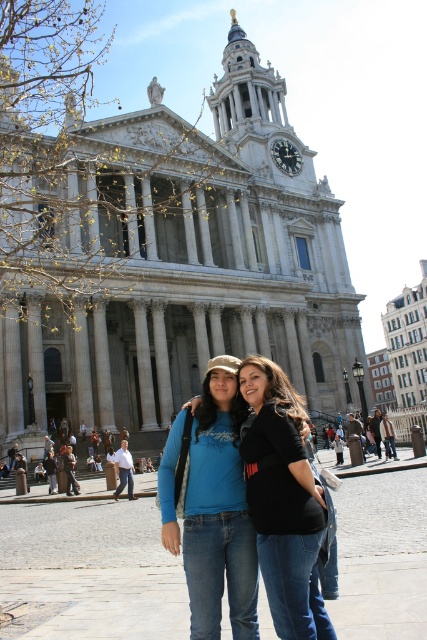
Looking at this image, you are a photographer standing in front of St. Paul Cathedral. You see the matte blue shirt at center and the denim jeans at center in the frame. Which of the two items is closer to the camera?

The matte blue shirt at center is closer to the camera because the denim jeans at center is behind it.

You are standing at the center of St. Paul Cathedral and want to take a photo of the person wearing the matte blue shirt at center. Which direction should you move to get them in the frame?

The matte blue shirt at center is located at point 0.806 on the x axis and 0.513 on the y axis. Since the center of the image is at point 0.5, you should move to the right to align the camera with the matte blue shirt at center.

You are a photographer standing in front of St. Paul Cathedral. You see the matte blue shirt at center and denim jeans at center. Which object is taller?

The matte blue shirt at center is much taller than the denim jeans at center.